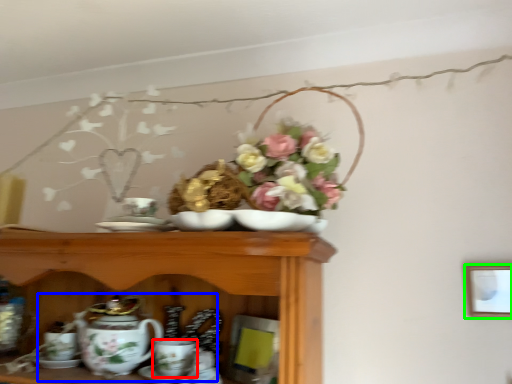
Question: Considering the real-world distances, which object is closest to coffee cup (highlighted by a red box)? tea set (highlighted by a blue box) or picture frame (highlighted by a green box).

Choices:
 (A) tea set
 (B) picture frame

Answer: (A)